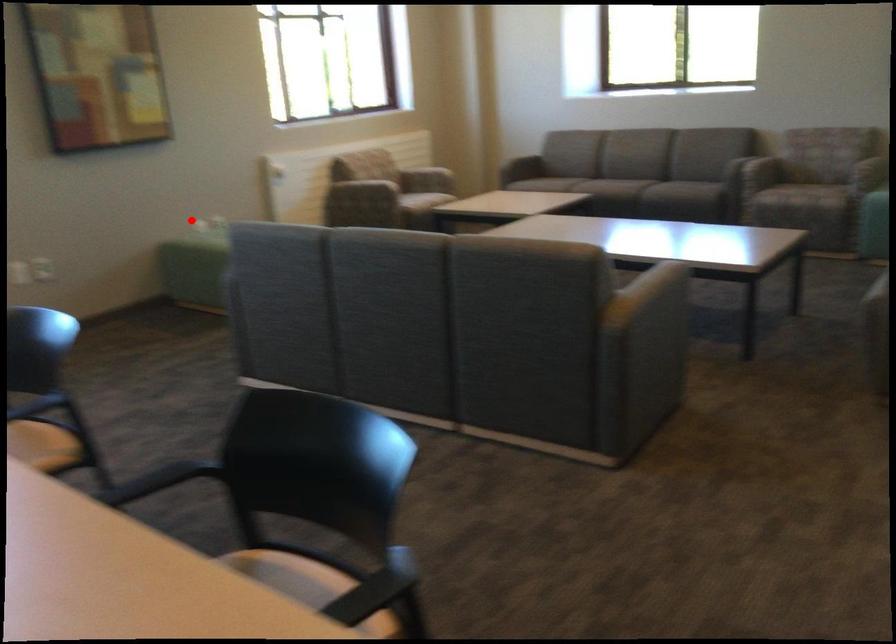
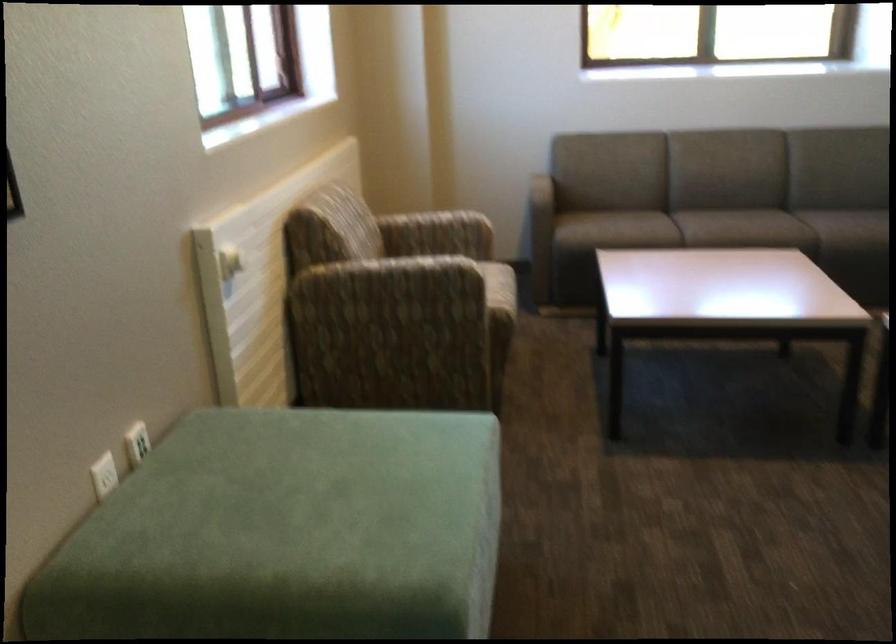
Question: A red point is marked in image1. In image2, is the corresponding 3D point closer to the camera or farther? Reply with the corresponding letter.

Choices:
 (A) The corresponding 3D point is closer.
 (B) The corresponding 3D point is farther.

Answer: (A)